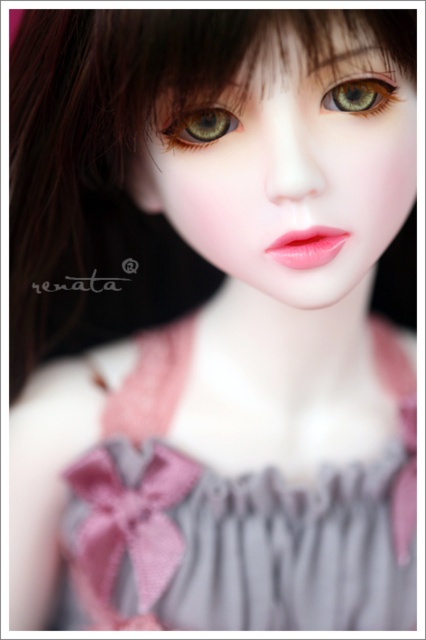
Is point (339, 568) positioned after point (396, 86)?

That is True.

Is point (118, 618) behind point (365, 72)?

Yes, point (118, 618) is farther from viewer.

This screenshot has height=640, width=426. What are the coordinates of `pink satin dress at center` in the screenshot? It's located at (236, 520).

Who is shorter, matte plastic face at center or green matte eye at center?

green matte eye at center

Is point (245, 42) more distant than point (169, 124)?

No, it is in front of (169, 124).

The width and height of the screenshot is (426, 640). I want to click on matte plastic face at center, so click(x=285, y=147).

You are a GUI agent. You are given a task and a screenshot of the screen. Output one action in this format:
    pyautogui.click(x=<x>, y=<y>)
    Task: Click on the matte plastic face at center
    This screenshot has width=426, height=640.
    Given the screenshot: What is the action you would take?
    pyautogui.click(x=285, y=147)

Is pink satin dress at center taller than green matte eye at center?

Yes, pink satin dress at center is taller than green matte eye at center.

Can you confirm if pink satin dress at center is thinner than green matte eye at center?

In fact, pink satin dress at center might be wider than green matte eye at center.

Does point (149, 372) come in front of point (183, 145)?

That is False.

Identify the location of pink satin dress at center. Image resolution: width=426 pixels, height=640 pixels. (236, 520).